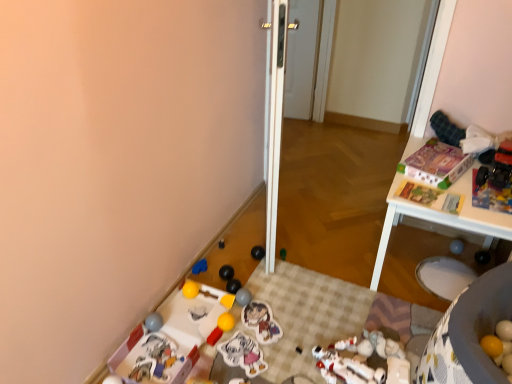
Question: Can you confirm if black rubber ball at lower center, which is counted as the 12th toy, starting from the left, is bigger than yellow matte toy at lower center, acting as the 12th toy starting from the right?

Choices:
 (A) yes
 (B) no

Answer: (A)

Question: Does black rubber ball at lower center, the eighth toy in the right-to-left sequence, contain yellow matte toy at lower center, which is counted as the eighth toy, starting from the left?

Choices:
 (A) no
 (B) yes

Answer: (A)

Question: Is black rubber ball at lower center, the eighth toy in the right-to-left sequence, directly adjacent to yellow matte toy at lower center, acting as the 12th toy starting from the right?

Choices:
 (A) no
 (B) yes

Answer: (A)

Question: Is black rubber ball at lower center, which is counted as the 12th toy, starting from the left, located outside yellow matte toy at lower center, acting as the 12th toy starting from the right?

Choices:
 (A) no
 (B) yes

Answer: (B)

Question: Considering the relative sizes of black rubber ball at lower center, the eighth toy in the right-to-left sequence, and yellow matte toy at lower center, which is counted as the eighth toy, starting from the left, in the image provided, is black rubber ball at lower center, the eighth toy in the right-to-left sequence, shorter than yellow matte toy at lower center, which is counted as the eighth toy, starting from the left,?

Choices:
 (A) no
 (B) yes

Answer: (A)

Question: Would you say white plastic table at upper right is inside or outside matte cardboard box at upper right, the sixteenth toy when ordered from left to right?

Choices:
 (A) outside
 (B) inside

Answer: (A)

Question: Is white plastic table at upper right in front of or behind matte cardboard box at upper right, marked as the 4th toy in a right-to-left arrangement, in the image?

Choices:
 (A) behind
 (B) front

Answer: (B)

Question: Considering the positions of point (509, 236) and point (434, 160), is point (509, 236) closer or farther from the camera than point (434, 160)?

Choices:
 (A) closer
 (B) farther

Answer: (A)

Question: Based on their sizes in the image, would you say white plastic table at upper right is bigger or smaller than matte cardboard box at upper right, the sixteenth toy when ordered from left to right?

Choices:
 (A) big
 (B) small

Answer: (A)

Question: Looking at their shapes, would you say blue fabric toy at lower left, the fifteenth toy in the right-to-left sequence, is wider or thinner than plastic toy at lower left, which is the 17th toy in right-to-left order?

Choices:
 (A) thin
 (B) wide

Answer: (A)

Question: Considering the relative positions of blue fabric toy at lower left, the fifteenth toy in the right-to-left sequence, and plastic toy at lower left, the 3th toy from the left, in the image provided, is blue fabric toy at lower left, the fifteenth toy in the right-to-left sequence, to the left or to the right of plastic toy at lower left, the 3th toy from the left,?

Choices:
 (A) right
 (B) left

Answer: (A)

Question: From their relative heights in the image, would you say blue fabric toy at lower left, placed as the fifth toy when sorted from left to right, is taller or shorter than plastic toy at lower left, which is the 17th toy in right-to-left order?

Choices:
 (A) short
 (B) tall

Answer: (A)

Question: From the image's perspective, is blue fabric toy at lower left, placed as the fifth toy when sorted from left to right, located above or below plastic toy at lower left, which is the 17th toy in right-to-left order?

Choices:
 (A) above
 (B) below

Answer: (A)

Question: Based on their positions, is matte gray ball at lower left, placed as the 1th toy when sorted from left to right, located to the left or right of yellow matte ball at lower right, the third toy positioned from the right?

Choices:
 (A) right
 (B) left

Answer: (B)

Question: Considering the positions of matte gray ball at lower left, acting as the nineteenth toy starting from the right, and yellow matte ball at lower right, the third toy positioned from the right, in the image, is matte gray ball at lower left, acting as the nineteenth toy starting from the right, wider or thinner than yellow matte ball at lower right, the third toy positioned from the right,?

Choices:
 (A) thin
 (B) wide

Answer: (B)